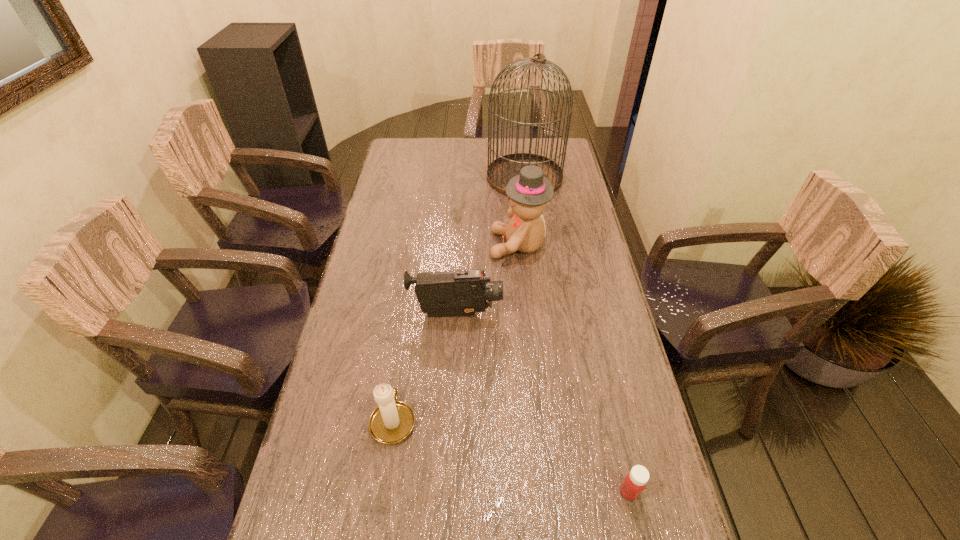
You are a GUI agent. You are given a task and a screenshot of the screen. Output one action in this format:
    pyautogui.click(x=<x>, y=<y>)
    Task: Click on the tallest object
    
    Given the screenshot: What is the action you would take?
    pyautogui.click(x=500, y=171)

What are the coordinates of `the farthest object` in the screenshot? It's located at (x=500, y=171).

Where is `the fourth nearest object`? Image resolution: width=960 pixels, height=540 pixels. the fourth nearest object is located at coordinates (528, 192).

Locate an element on the screen. The image size is (960, 540). the second tallest object is located at coordinates (528, 192).

Find the location of a particular element. This screenshot has height=540, width=960. the third farthest object is located at coordinates (463, 292).

Locate an element on the screen. candle holder is located at coordinates (392, 421).

Where is `medicine`? The width and height of the screenshot is (960, 540). medicine is located at coordinates (634, 483).

Identify the location of the shortest object. (634, 483).

Locate an element on the screen. This screenshot has width=960, height=540. vacant space situated on the left of the birdcage is located at coordinates (442, 177).

You are a GUI agent. You are given a task and a screenshot of the screen. Output one action in this format:
    pyautogui.click(x=<x>, y=<y>)
    Task: Click on the vacant space located 0.260m on the front-facing side of the second farthest object
    The width and height of the screenshot is (960, 540).
    Given the screenshot: What is the action you would take?
    pyautogui.click(x=412, y=245)